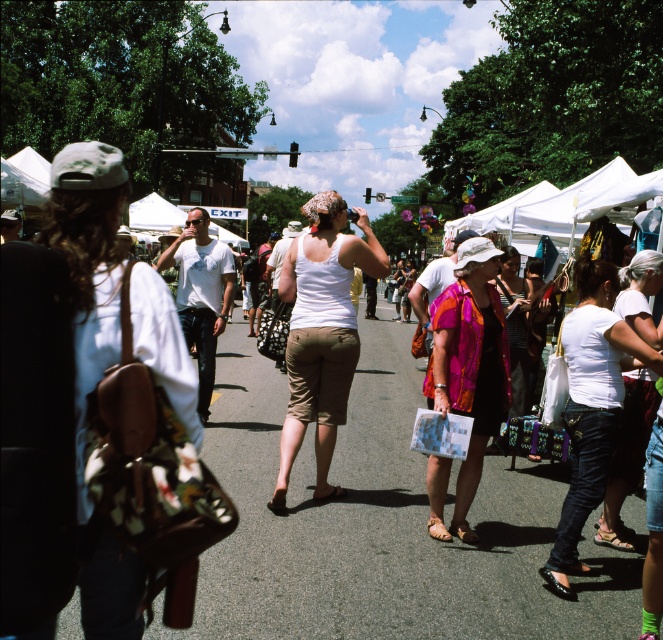
Which is more to the right, white denim jeans at lower right or white cotton t-shirt at center?

white denim jeans at lower right is more to the right.

Can you confirm if white denim jeans at lower right is taller than white cotton t-shirt at center?

In fact, white denim jeans at lower right may be shorter than white cotton t-shirt at center.

Measure the distance between white denim jeans at lower right and camera.

The distance of white denim jeans at lower right from camera is 13.89 feet.

The height and width of the screenshot is (640, 663). In order to click on white denim jeans at lower right in this screenshot , I will do `click(591, 404)`.

Can you confirm if brown leather backpack at left is shorter than multicolored fabric dress at center?

Indeed, brown leather backpack at left has a lesser height compared to multicolored fabric dress at center.

Can you confirm if brown leather backpack at left is positioned to the right of multicolored fabric dress at center?

Incorrect, brown leather backpack at left is not on the right side of multicolored fabric dress at center.

Where is `brown leather backpack at left`? This screenshot has width=663, height=640. brown leather backpack at left is located at coordinates (74, 388).

Based on the photo, is white matte tank top at center to the left of white cotton t-shirt at center from the viewer's perspective?

Incorrect, white matte tank top at center is not on the left side of white cotton t-shirt at center.

In the scene shown: How distant is white matte tank top at center from white cotton t-shirt at center?

A distance of 4.25 feet exists between white matte tank top at center and white cotton t-shirt at center.

Image resolution: width=663 pixels, height=640 pixels. What do you see at coordinates (322, 332) in the screenshot?
I see `white matte tank top at center` at bounding box center [322, 332].

At what (x,y) coordinates should I click in order to perform the action: click on white matte tank top at center. Please return your answer as a coordinate pair (x, y). Image resolution: width=663 pixels, height=640 pixels. Looking at the image, I should click on (322, 332).